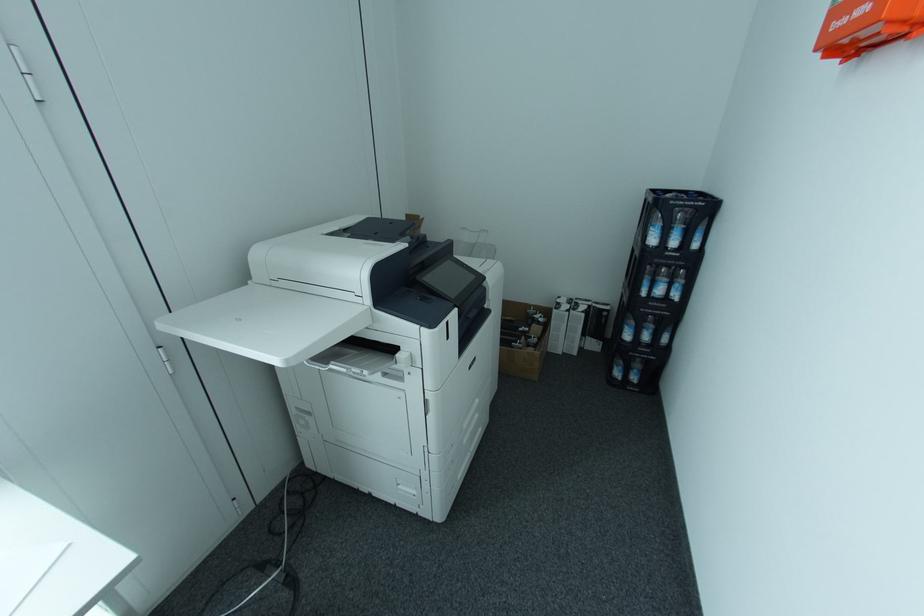
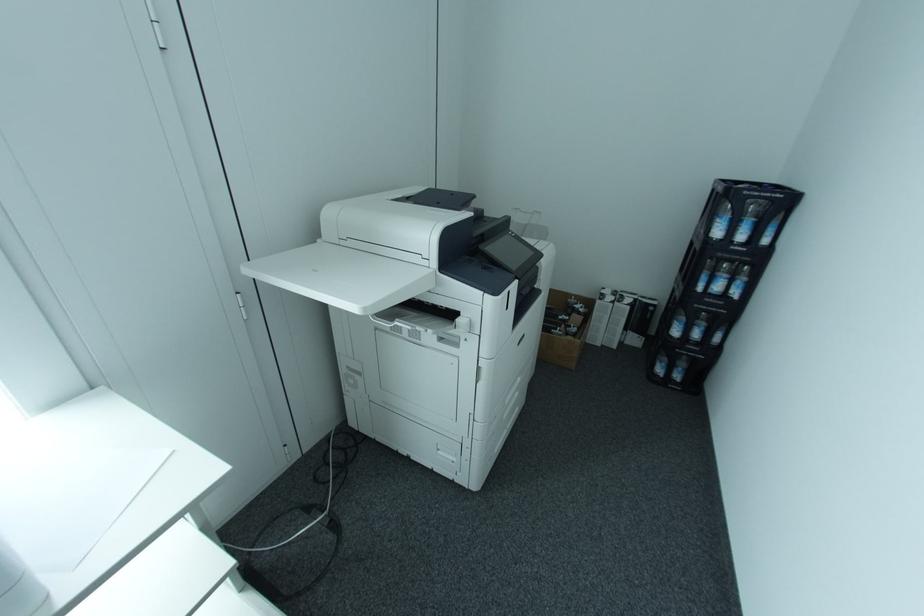
Question: Based on the continuous images, in which direction is the camera rotating? Reply with the corresponding letter.

Choices:
 (A) Left
 (B) Right
 (C) Up
 (D) Down

Answer: (A)